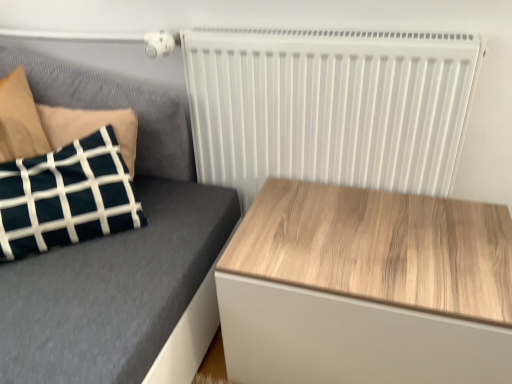
Question: Considering the relative positions of velvet dark blue pillow at left and white matte radiator at upper right in the image provided, is velvet dark blue pillow at left behind white matte radiator at upper right?

Choices:
 (A) yes
 (B) no

Answer: (B)

Question: Can you confirm if velvet dark blue pillow at left is positioned to the left of white matte radiator at upper right?

Choices:
 (A) no
 (B) yes

Answer: (B)

Question: Is the position of velvet dark blue pillow at left less distant than that of white matte radiator at upper right?

Choices:
 (A) no
 (B) yes

Answer: (B)

Question: Does velvet dark blue pillow at left have a greater width compared to white matte radiator at upper right?

Choices:
 (A) no
 (B) yes

Answer: (B)

Question: Does velvet dark blue pillow at left have a greater height compared to white matte radiator at upper right?

Choices:
 (A) yes
 (B) no

Answer: (B)

Question: Is velvet dark blue pillow at left not inside white matte radiator at upper right?

Choices:
 (A) yes
 (B) no

Answer: (A)

Question: From a real-world perspective, does white matte radiator at upper right sit lower than wooden table at right?

Choices:
 (A) yes
 (B) no

Answer: (B)

Question: Is white matte radiator at upper right to the left of wooden table at right from the viewer's perspective?

Choices:
 (A) yes
 (B) no

Answer: (A)

Question: Is white matte radiator at upper right next to wooden table at right?

Choices:
 (A) yes
 (B) no

Answer: (B)

Question: Is white matte radiator at upper right located outside wooden table at right?

Choices:
 (A) no
 (B) yes

Answer: (B)

Question: Can you confirm if white matte radiator at upper right is bigger than wooden table at right?

Choices:
 (A) yes
 (B) no

Answer: (B)

Question: Is white matte radiator at upper right facing towards wooden table at right?

Choices:
 (A) no
 (B) yes

Answer: (B)

Question: Does velvet dark blue pillow at left appear on the left side of wooden table at right?

Choices:
 (A) no
 (B) yes

Answer: (B)